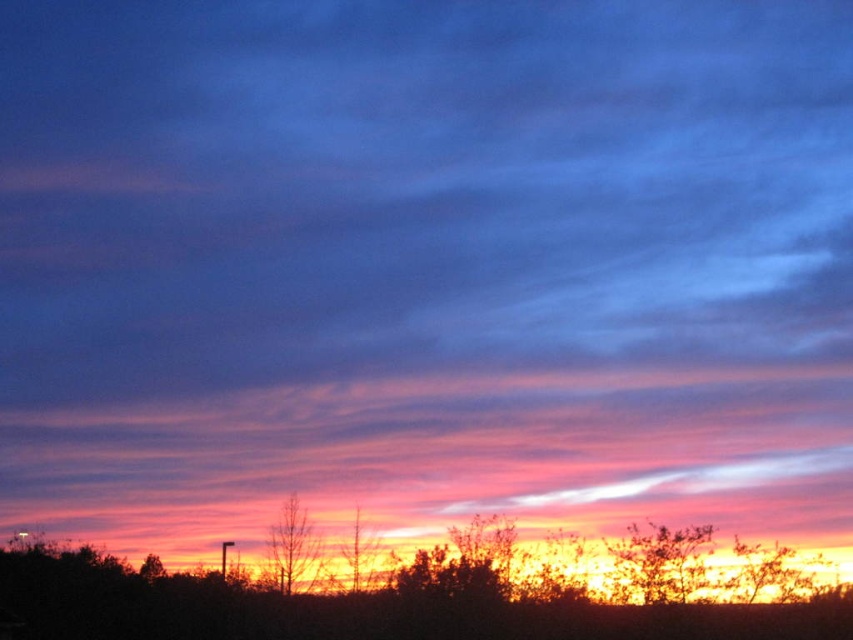
Is bare branches at center wider than silhouette wood at center?

Yes.

Is point (299, 557) less distant than point (347, 552)?

Yes, it is.

Which is in front, point (293, 545) or point (341, 550)?

Point (293, 545) is in front.

Find the location of a particular element. Image resolution: width=853 pixels, height=640 pixels. bare branches at center is located at coordinates (293, 547).

Can you confirm if silhouette tree at lower center is positioned to the right of bare branches at center?

Indeed, silhouette tree at lower center is positioned on the right side of bare branches at center.

Which is behind, point (642, 625) or point (317, 556)?

The point (317, 556) is more distant.

Is point (787, 628) farther from viewer compared to point (297, 561)?

That is False.

Where is `silhouette tree at lower center`? The image size is (853, 640). silhouette tree at lower center is located at coordinates (355, 609).

Which is below, silhouette tree at lower center or silhouette wood at center?

silhouette tree at lower center

Does silhouette tree at lower center appear over silhouette wood at center?

No.

Does point (155, 596) come closer to viewer compared to point (354, 572)?

That is False.

Locate an element on the screen. silhouette tree at lower center is located at coordinates (355, 609).